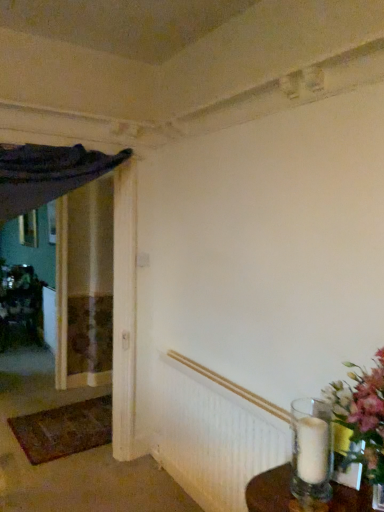
I want to click on free point above brown woven mat at lower left (from a real-world perspective), so [78, 420].